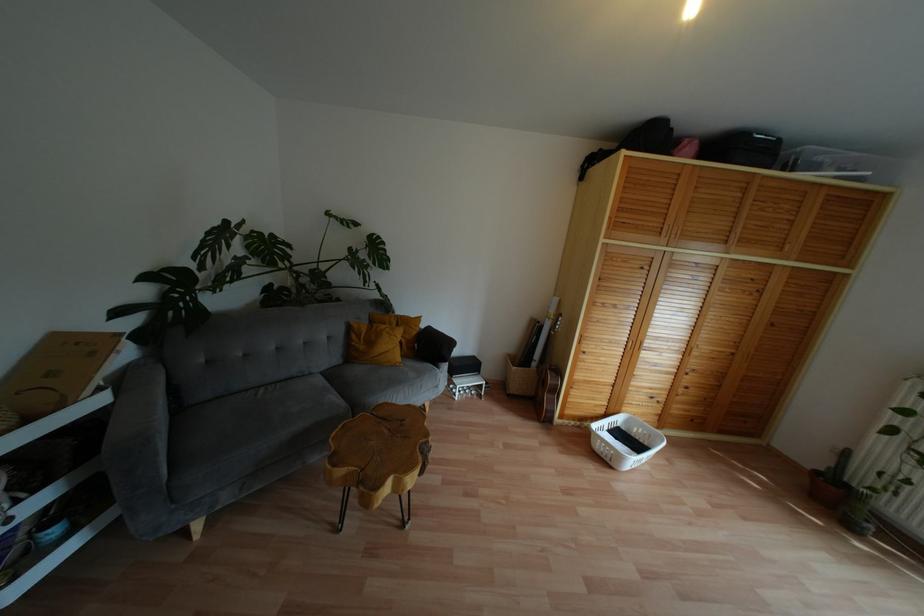
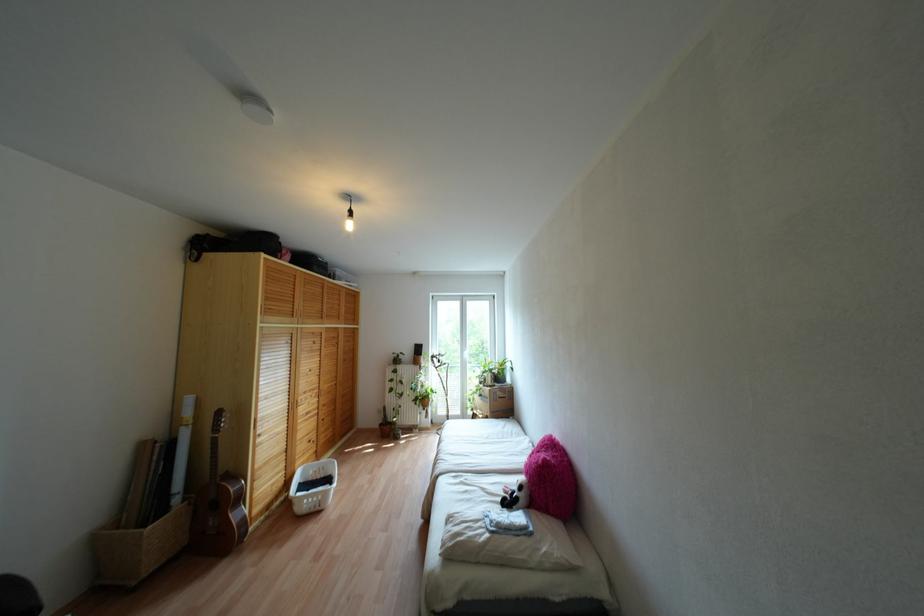
In the second image, find the point that corresponds to point (703, 347) in the first image.

(324, 387)